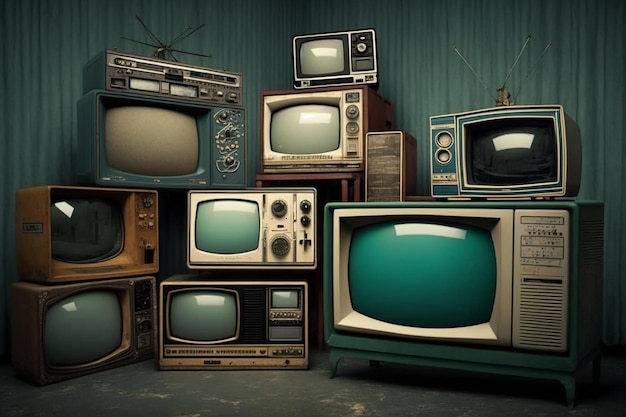
The image size is (626, 417). I want to click on bottom five televisions, so [411, 273], [230, 237], [80, 245], [59, 331], [188, 324].